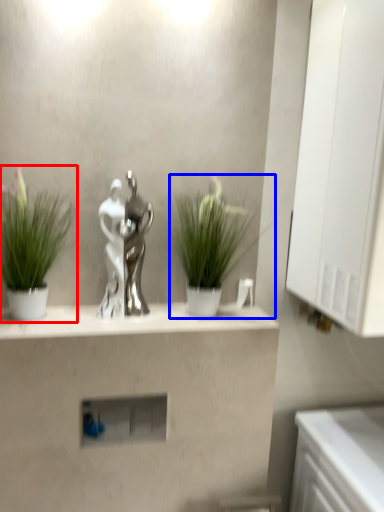
Question: Which object appears closest to the camera in this image, houseplant (highlighted by a red box) or houseplant (highlighted by a blue box)?

Choices:
 (A) houseplant
 (B) houseplant

Answer: (A)